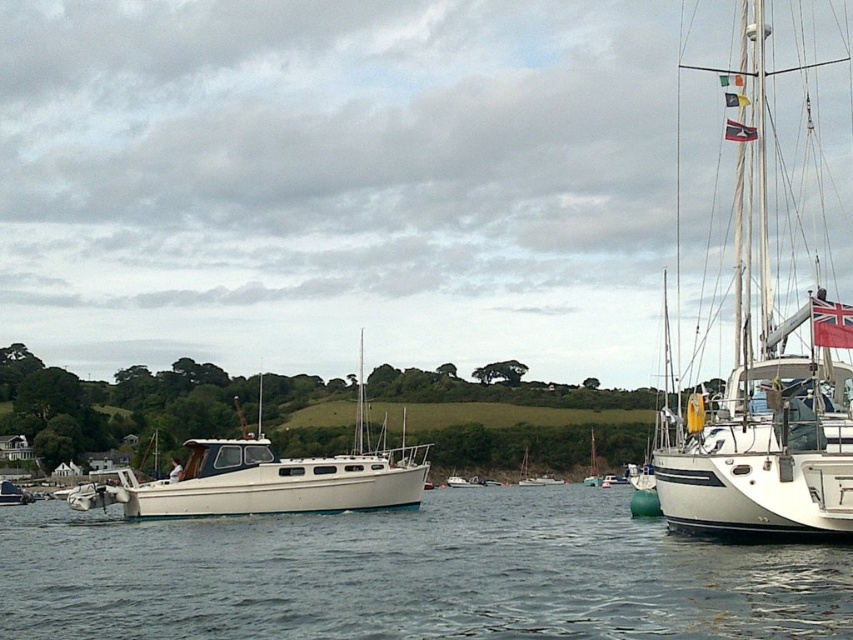
Does white glossy sailboat at right appear under white matte boat at center?

Incorrect, white glossy sailboat at right is not positioned below white matte boat at center.

Between white glossy sailboat at right and white matte boat at center, which one has more height?

Standing taller between the two is white glossy sailboat at right.

Does point (822, 417) come behind point (384, 508)?

No.

Identify the location of white glossy sailboat at right. This screenshot has height=640, width=853. (764, 372).

Find the location of a particular element. The image size is (853, 640). clear water at center is located at coordinates (410, 576).

Does point (30, 609) lie in front of point (277, 499)?

Yes, point (30, 609) is in front of point (277, 499).

You are a GUI agent. You are given a task and a screenshot of the screen. Output one action in this format:
    pyautogui.click(x=<x>, y=<y>)
    Task: Click on the clear water at center
    
    Given the screenshot: What is the action you would take?
    pyautogui.click(x=410, y=576)

Between clear water at center and white glossy sailboat at right, which one has more height?

Standing taller between the two is white glossy sailboat at right.

Which is above, clear water at center or white glossy sailboat at right?

white glossy sailboat at right

The width and height of the screenshot is (853, 640). Describe the element at coordinates (410, 576) in the screenshot. I see `clear water at center` at that location.

Locate an element on the screen. The width and height of the screenshot is (853, 640). clear water at center is located at coordinates (410, 576).